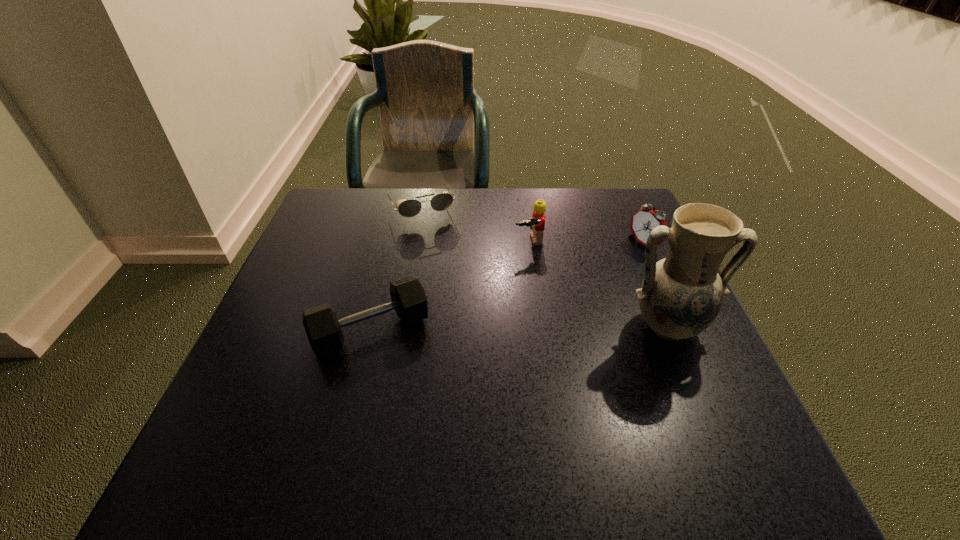
Where is `the second shortest object`? This screenshot has height=540, width=960. the second shortest object is located at coordinates (323, 329).

In order to click on pottery in this screenshot , I will do `click(681, 295)`.

Locate an element on the screen. This screenshot has height=540, width=960. alarm clock is located at coordinates (646, 219).

The width and height of the screenshot is (960, 540). Identify the location of the farthest object. (409, 208).

Where is `sunglasses`? The height and width of the screenshot is (540, 960). sunglasses is located at coordinates (409, 208).

You are a GUI agent. You are given a task and a screenshot of the screen. Output one action in this format:
    pyautogui.click(x=<x>, y=<y>)
    Task: Click on the third object from right to left
    
    Given the screenshot: What is the action you would take?
    pyautogui.click(x=537, y=223)

At what (x,y) coordinates should I click in order to perform the action: click on vacant space located on the back of the fourth tallest object. Please return your answer as a coordinate pair (x, y). Looking at the image, I should click on (396, 229).

This screenshot has width=960, height=540. I want to click on vacant area situated 0.060m on either side of the tallest object, so click(x=689, y=380).

The image size is (960, 540). What are the coordinates of `vacant space located on the clock face of the alarm clock` in the screenshot? It's located at (516, 314).

Locate an element on the screen. This screenshot has height=540, width=960. vacant space located on the clock face of the alarm clock is located at coordinates (537, 302).